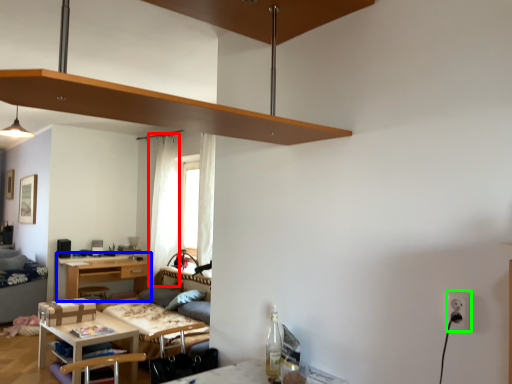
Question: Based on their relative distances, which object is farther from curtain (highlighted by a red box)? Choose from desk (highlighted by a blue box) and electric outlet (highlighted by a green box).

Choices:
 (A) desk
 (B) electric outlet

Answer: (B)